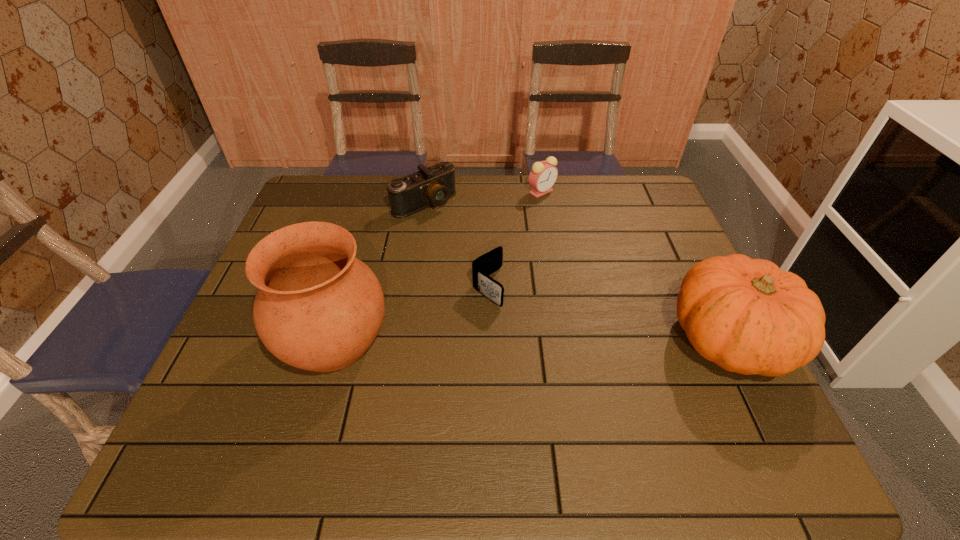
I want to click on free space on the desktop that is between the tallest object and the fourth shortest object and is positioned on the outer surface of the shortest object, so tap(558, 340).

Find the location of `free spot on the desktop that is between the pottery and the pumpkin and is positioned on the lens of the camera`. free spot on the desktop that is between the pottery and the pumpkin and is positioned on the lens of the camera is located at coordinates (585, 340).

This screenshot has width=960, height=540. I want to click on free space on the desktop that is between the pottery and the pumpkin and is positioned on the face of the fourth object from left to right, so click(x=552, y=340).